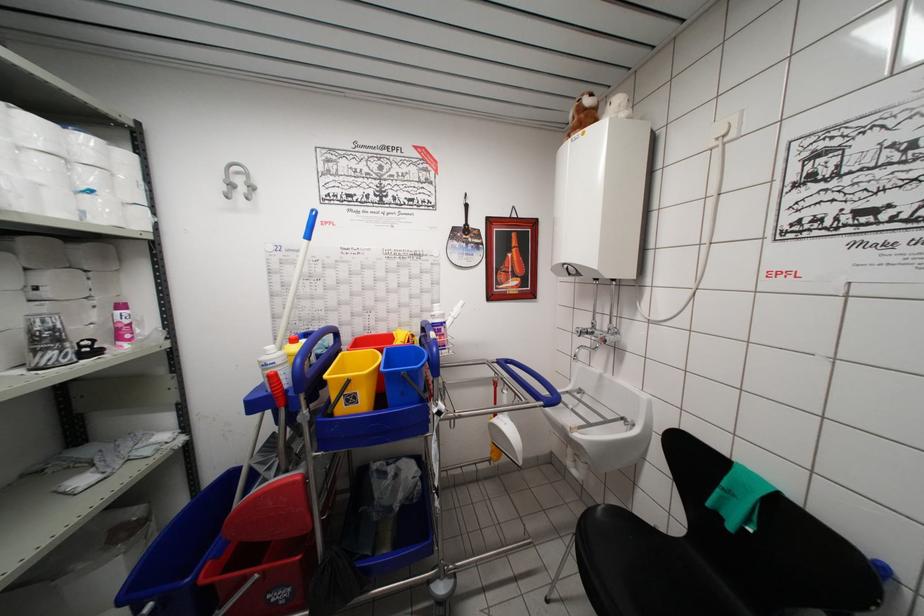
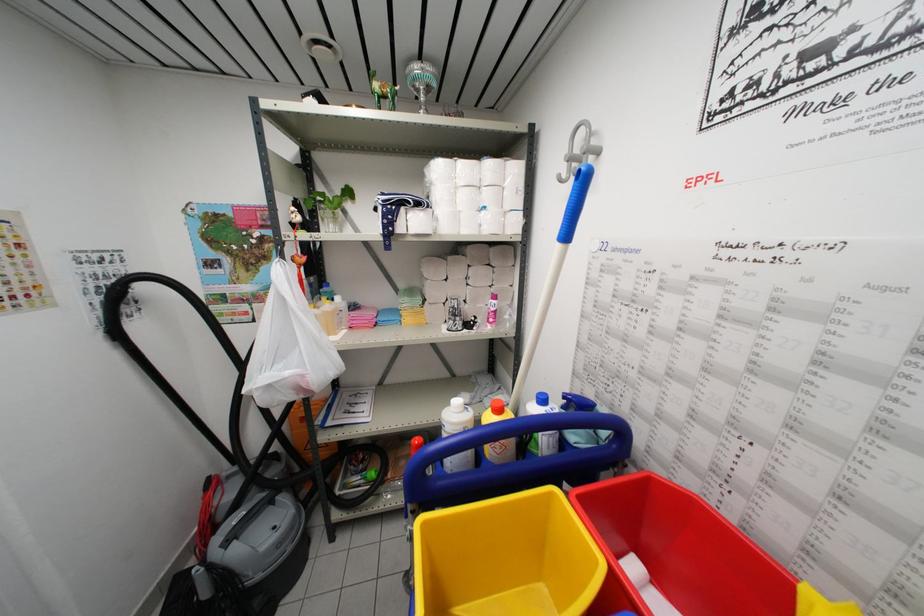
The point at (x=137, y=456) is marked in the first image. Where is the corresponding point in the second image?

(490, 402)